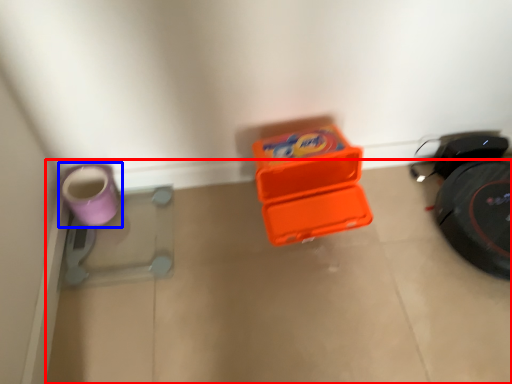
Question: Which object is further to the camera taking this photo, concrete (highlighted by a red box) or footwear (highlighted by a blue box)?

Choices:
 (A) concrete
 (B) footwear

Answer: (B)